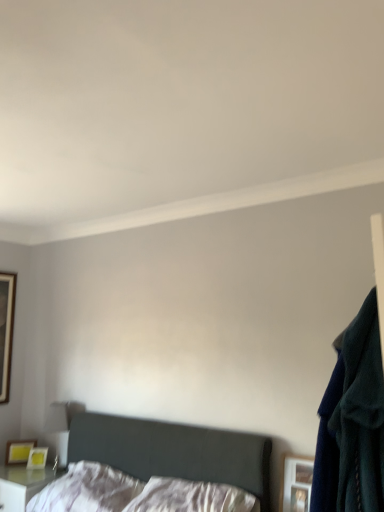
Locate an element on the screen. Image resolution: width=384 pixels, height=512 pixels. vacant region in front of matte yellow picture frame at lower left, which appears as the second picture frame when viewed from the front is located at coordinates (9, 473).